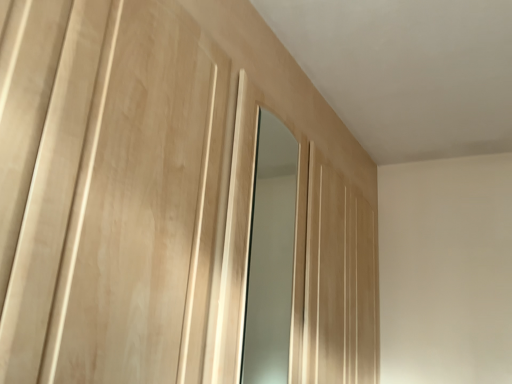
Question: Should I look upward or downward to see matte wooden mirror at center?

Choices:
 (A) up
 (B) down

Answer: (B)